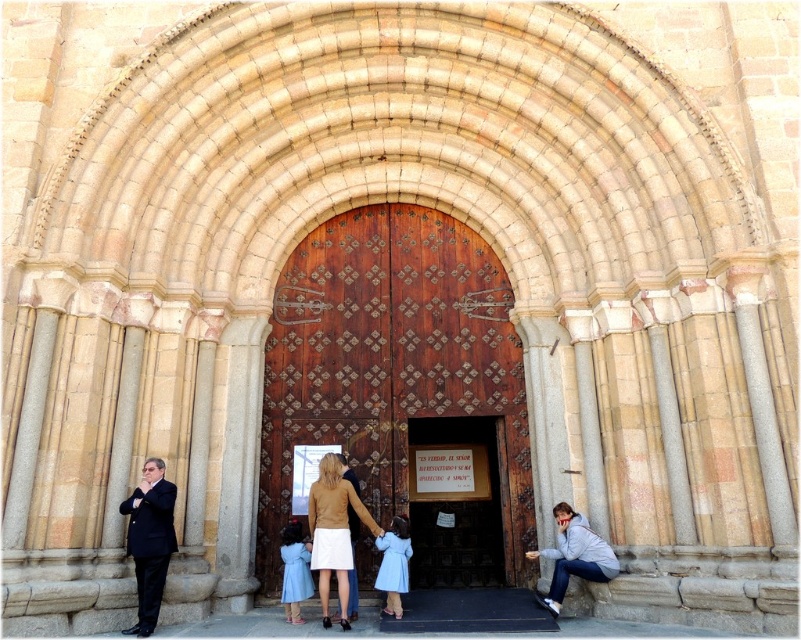
Question: Which of the following is the closest to the observer?

Choices:
 (A) light blue satin dress at center
 (B) light blue fabric dress at center
 (C) matte black suit at left
 (D) dark brown suit at center

Answer: (C)

Question: Which of the following is the closest to the observer?

Choices:
 (A) wooden at center
 (B) matte black suit at left
 (C) light blue fabric dress at center
 (D) matte brown jacket at center

Answer: (B)

Question: From the image, what is the correct spatial relationship of matte black suit at left in relation to dark brown suit at center?

Choices:
 (A) below
 (B) above

Answer: (B)

Question: Considering the relative positions of wooden at center and dark brown suit at center in the image provided, where is wooden at center located with respect to dark brown suit at center?

Choices:
 (A) below
 (B) above

Answer: (B)

Question: Which of the following is the farthest from the observer?

Choices:
 (A) matte black suit at left
 (B) light blue satin dress at center
 (C) wooden at center
 (D) dark brown suit at center

Answer: (C)

Question: Does matte black suit at left have a greater width compared to light blue fabric dress at center?

Choices:
 (A) yes
 (B) no

Answer: (A)